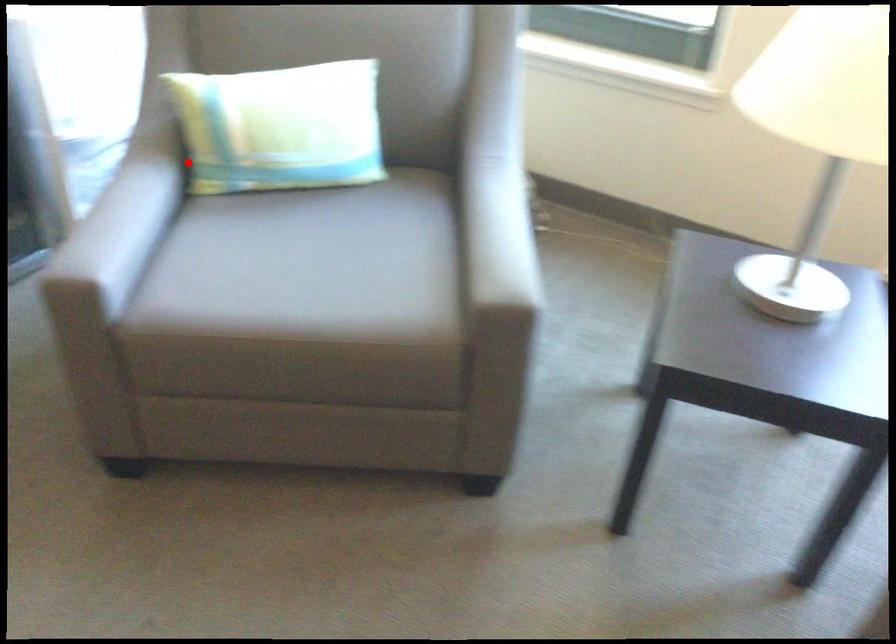
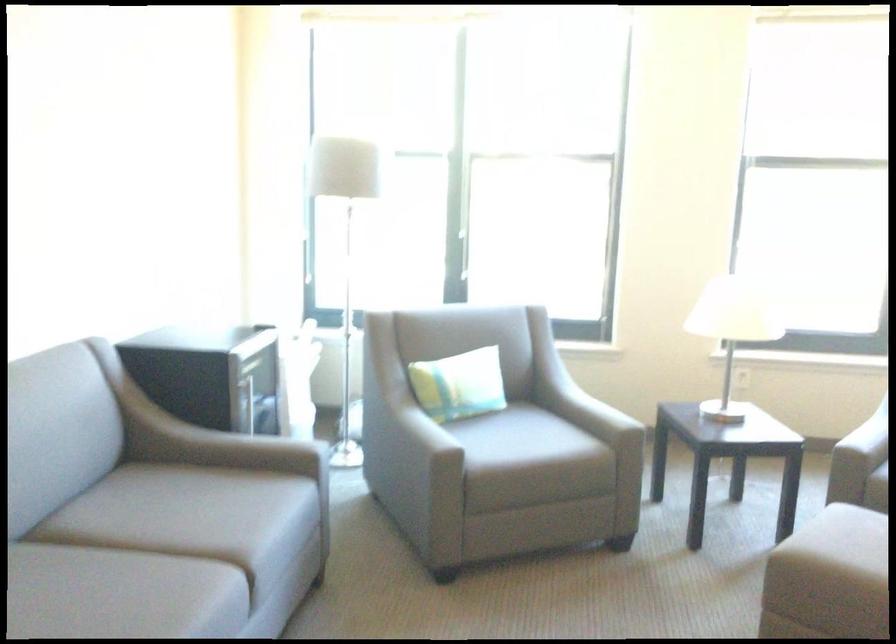
Question: I am providing you with two images of the same scene from different viewpoints. Image1 has a red point marked. In image2, the corresponding 3D location appears at what relative position? Reply with the corresponding letter.

Choices:
 (A) Closer
 (B) Farther

Answer: (B)